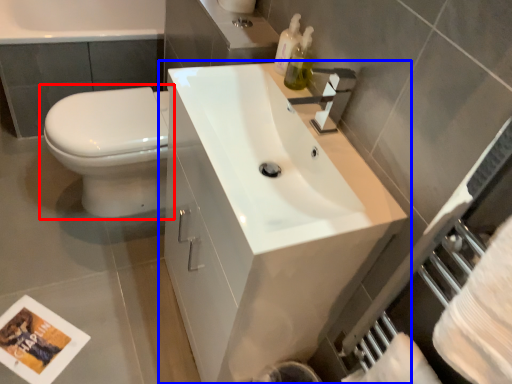
Question: Among these objects, which one is nearest to the camera, toilet (highlighted by a red box) or bathroom cabinet (highlighted by a blue box)?

Choices:
 (A) toilet
 (B) bathroom cabinet

Answer: (B)